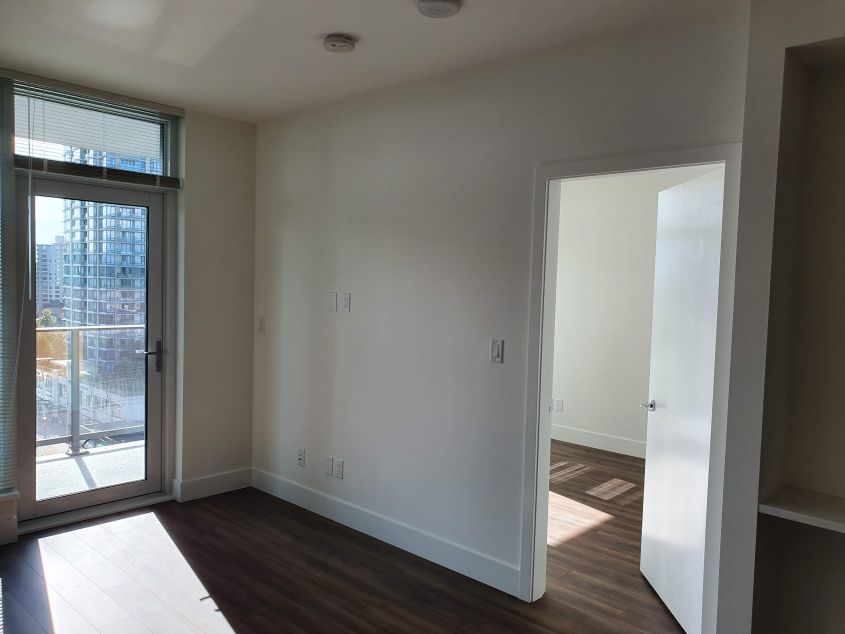
At what (x,y) coordinates should I click in order to perform the action: click on floor. Please return your answer as a coordinate pair (x, y). This screenshot has height=634, width=845. Looking at the image, I should click on (122, 581), (598, 499), (791, 577).